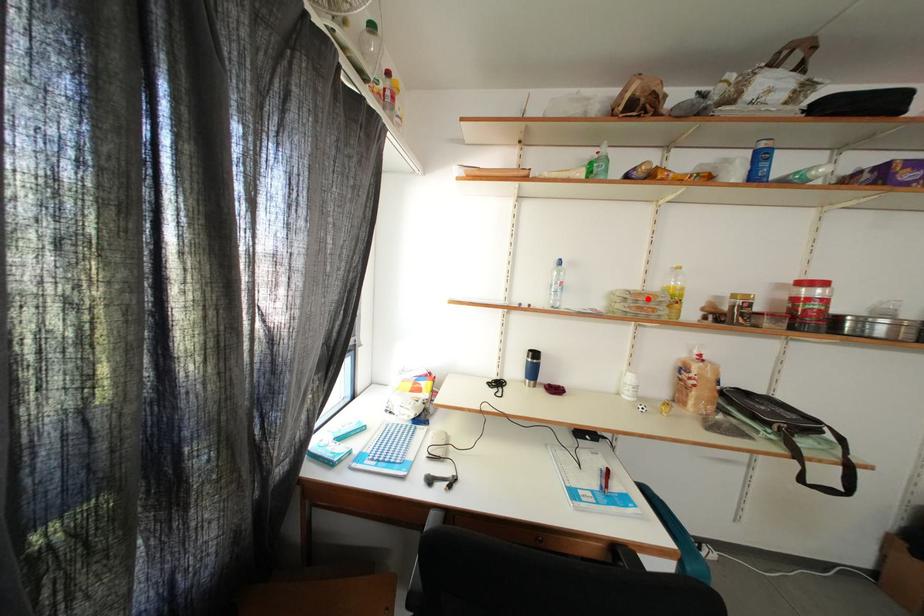
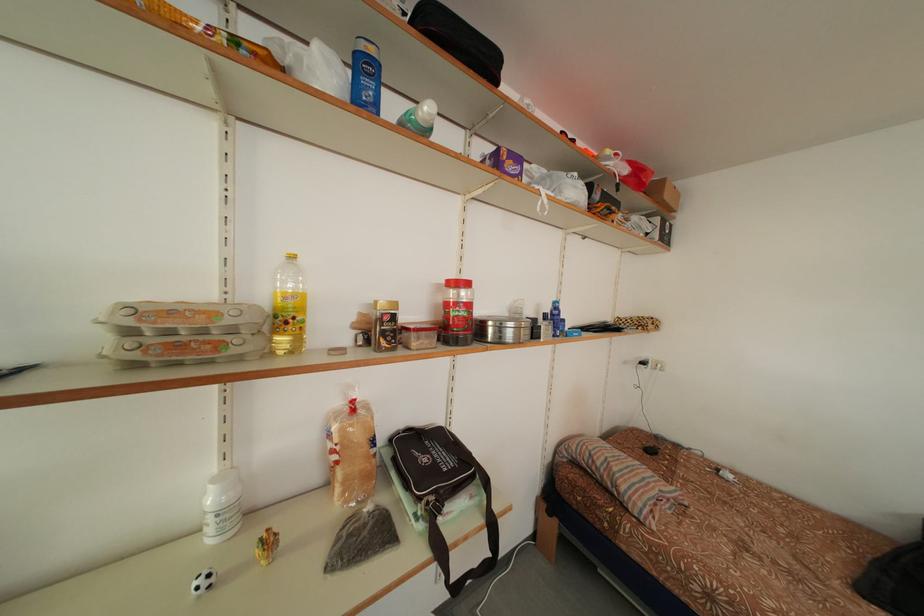
In the second image, find the point that corresponds to the highlighted location in the first image.

(178, 317)